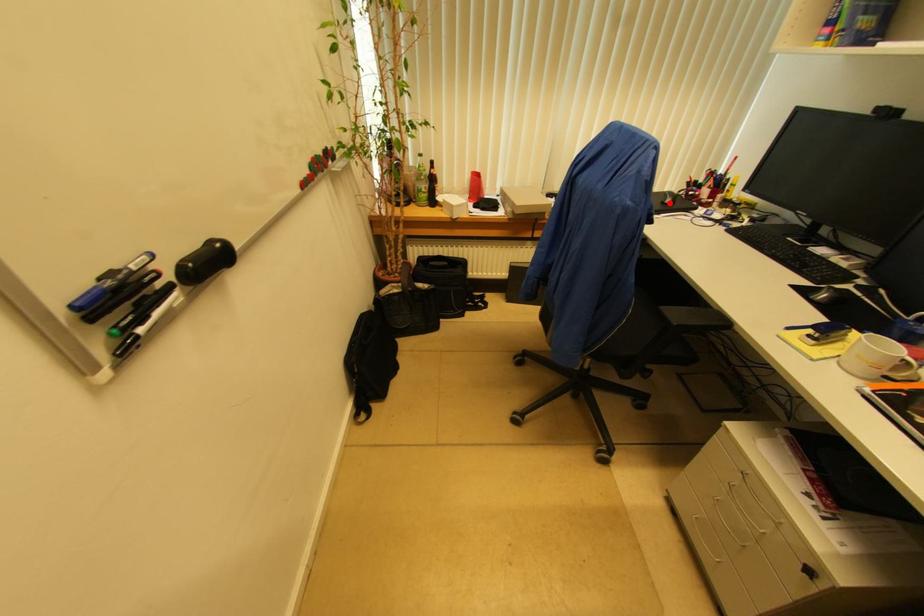
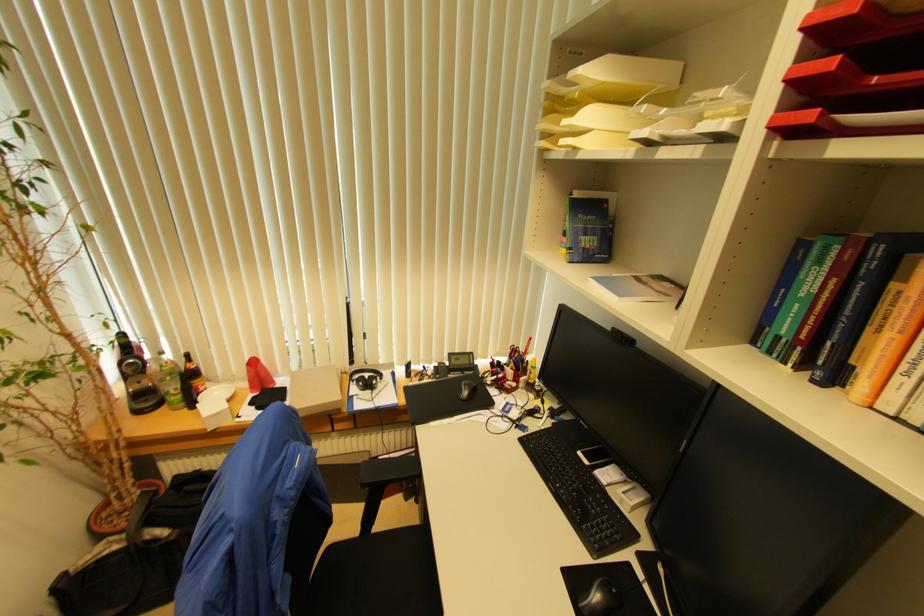
In the second image, find the point that corresponds to the highlighted location in the first image.

(467, 395)